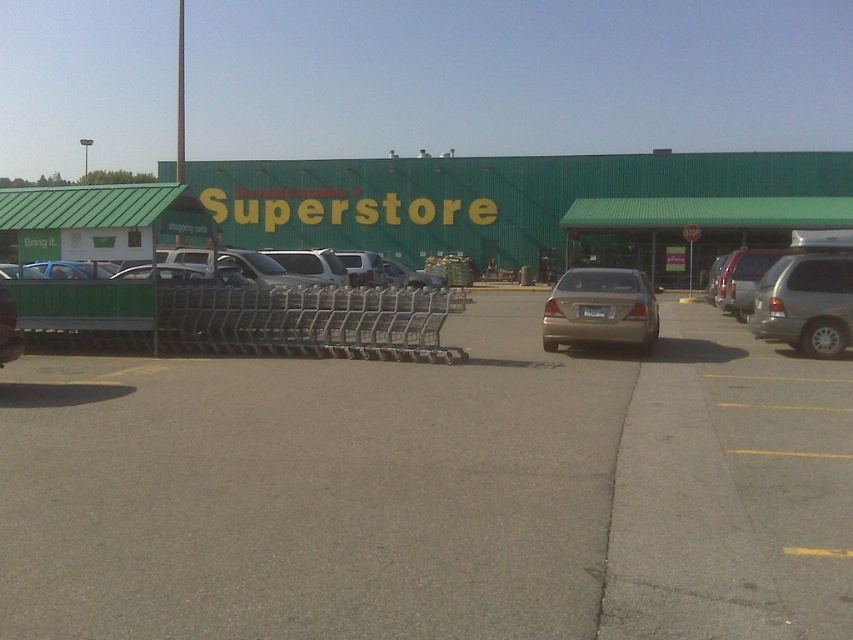
Between green matte superstore at center and matte silver suv at center, which one is positioned lower?

matte silver suv at center

Does green matte superstore at center have a lesser width compared to matte silver suv at center?

In fact, green matte superstore at center might be wider than matte silver suv at center.

Does point (482, 200) lie behind point (344, 266)?

Yes, point (482, 200) is behind point (344, 266).

Locate an element on the screen. The height and width of the screenshot is (640, 853). green matte superstore at center is located at coordinates (531, 205).

Is the position of matte silver suv at center less distant than that of matte silver sedan at center?

Yes, matte silver suv at center is closer to the viewer.

Is matte silver suv at center smaller than matte silver sedan at center?

Incorrect, matte silver suv at center is not smaller in size than matte silver sedan at center.

This screenshot has height=640, width=853. Describe the element at coordinates (268, 269) in the screenshot. I see `matte silver suv at center` at that location.

At what (x,y) coordinates should I click in order to perform the action: click on matte silver suv at center. Please return your answer as a coordinate pair (x, y). Looking at the image, I should click on (268, 269).

You are a GUI agent. You are given a task and a screenshot of the screen. Output one action in this format:
    pyautogui.click(x=<x>, y=<y>)
    Task: Click on the gold matte sedan at center
    This screenshot has width=853, height=640.
    Given the screenshot: What is the action you would take?
    pyautogui.click(x=601, y=308)

Who is positioned more to the right, gold matte sedan at center or matte white van at center?

gold matte sedan at center is more to the right.

At what (x,y) coordinates should I click in order to perform the action: click on gold matte sedan at center. Please return your answer as a coordinate pair (x, y). This screenshot has height=640, width=853. Looking at the image, I should click on (601, 308).

This screenshot has height=640, width=853. Find the location of `gold matte sedan at center`. gold matte sedan at center is located at coordinates (601, 308).